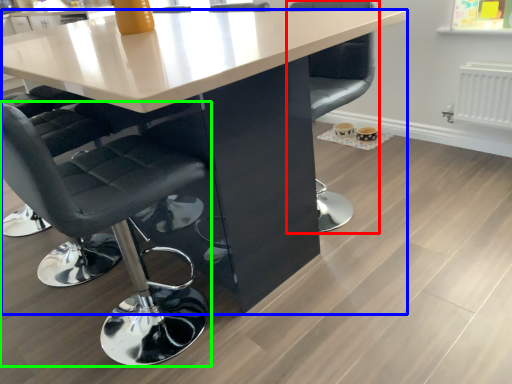
Question: Which object is positioned closest to chair (highlighted by a red box)? Select from table (highlighted by a blue box) and chair (highlighted by a green box).

Choices:
 (A) table
 (B) chair

Answer: (A)